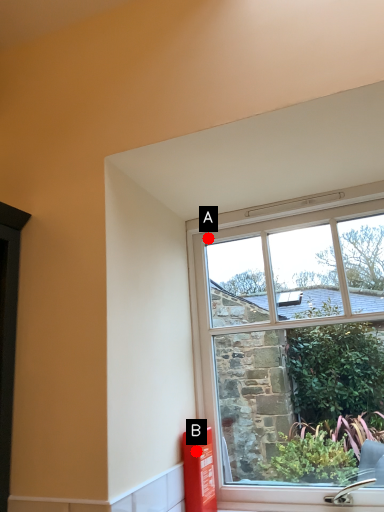
Question: Two points are circled on the image, labeled by A and B beside each circle. Which point is closer to the camera?

Choices:
 (A) A is closer
 (B) B is closer

Answer: (B)